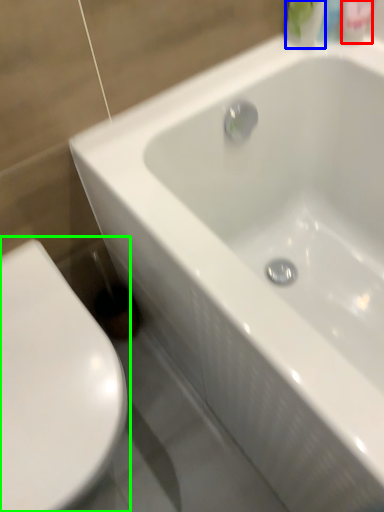
Question: Which object is positioned farthest from mouthwash (highlighted by a red box)? Select from mouthwash (highlighted by a blue box) and toilet (highlighted by a green box).

Choices:
 (A) mouthwash
 (B) toilet

Answer: (B)